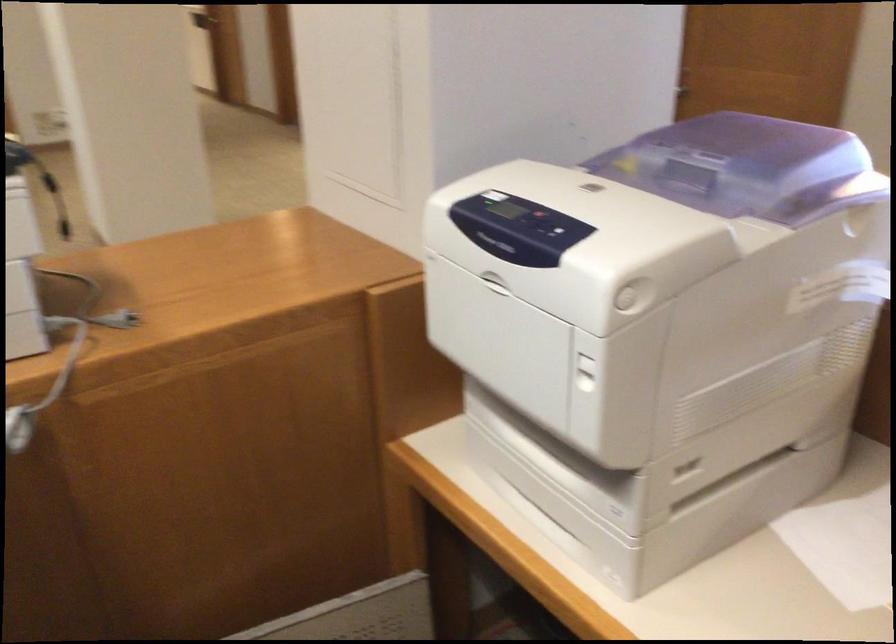
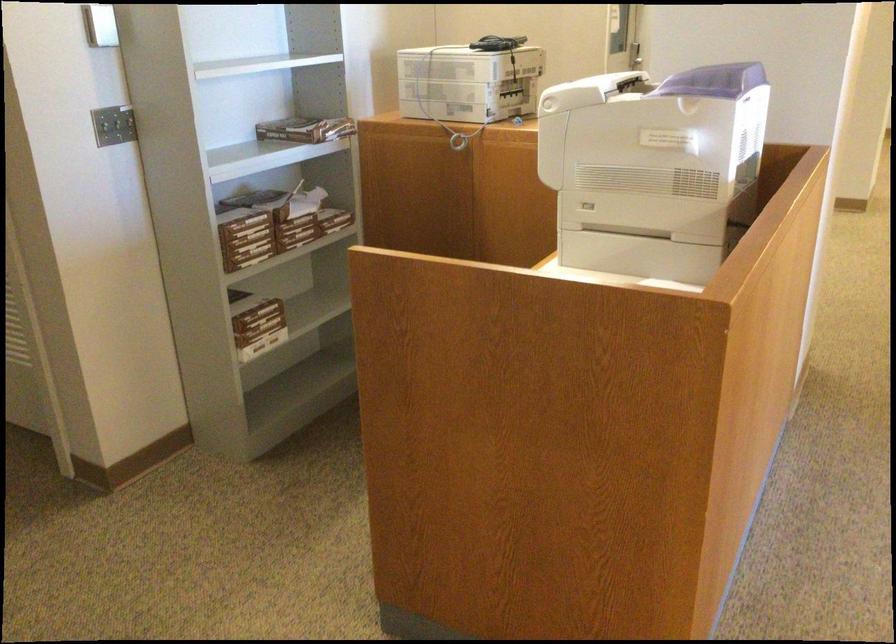
Question: I am providing you with two images of the same scene from different viewpoints. Which of the following objects are not visible in image2?

Choices:
 (A) printer scanner lid
 (B) printer paper tray
 (C) ream of paper
 (D) none of these

Answer: (D)